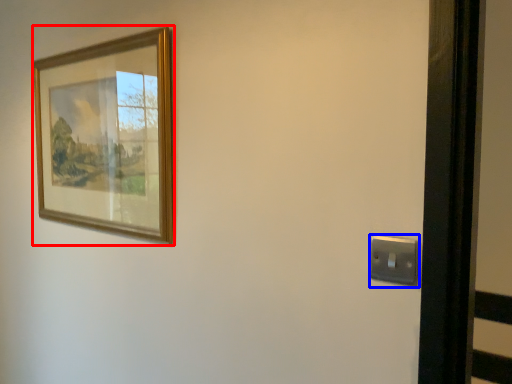
Question: Which point is closer to the camera, picture frame (highlighted by a red box) or light switch (highlighted by a blue box)?

Choices:
 (A) picture frame
 (B) light switch

Answer: (B)